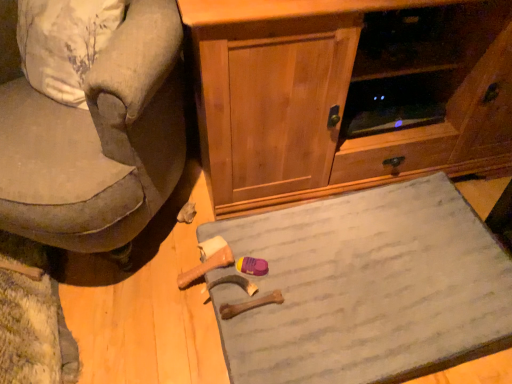
Question: Should I look upward or downward to see gray fabric doormat at lower center?

Choices:
 (A) up
 (B) down

Answer: (B)

Question: Could velvet gray armchair at left be considered to be inside gray fabric doormat at lower center?

Choices:
 (A) yes
 (B) no

Answer: (B)

Question: Considering the relative positions of gray fabric doormat at lower center and velvet gray armchair at left in the image provided, is gray fabric doormat at lower center in front of velvet gray armchair at left?

Choices:
 (A) no
 (B) yes

Answer: (A)

Question: Is there a large distance between gray fabric doormat at lower center and velvet gray armchair at left?

Choices:
 (A) yes
 (B) no

Answer: (B)

Question: Is gray fabric doormat at lower center taller than velvet gray armchair at left?

Choices:
 (A) yes
 (B) no

Answer: (B)

Question: Is gray fabric doormat at lower center next to velvet gray armchair at left?

Choices:
 (A) yes
 (B) no

Answer: (B)

Question: Considering the relative sizes of gray fabric doormat at lower center and velvet gray armchair at left in the image provided, is gray fabric doormat at lower center shorter than velvet gray armchair at left?

Choices:
 (A) no
 (B) yes

Answer: (B)

Question: From the image's perspective, is velvet gray armchair at left located beneath gray fabric doormat at lower center?

Choices:
 (A) yes
 (B) no

Answer: (B)

Question: Is velvet gray armchair at left positioned far away from gray fabric doormat at lower center?

Choices:
 (A) yes
 (B) no

Answer: (B)

Question: From a real-world perspective, is velvet gray armchair at left located beneath gray fabric doormat at lower center?

Choices:
 (A) yes
 (B) no

Answer: (B)

Question: Does velvet gray armchair at left lie in front of gray fabric doormat at lower center?

Choices:
 (A) yes
 (B) no

Answer: (A)

Question: Is velvet gray armchair at left wider than gray fabric doormat at lower center?

Choices:
 (A) yes
 (B) no

Answer: (A)

Question: Are velvet gray armchair at left and gray fabric doormat at lower center beside each other?

Choices:
 (A) yes
 (B) no

Answer: (B)

Question: Does gray fabric doormat at lower center have a lesser width compared to wooden cabinet at center?

Choices:
 (A) yes
 (B) no

Answer: (A)